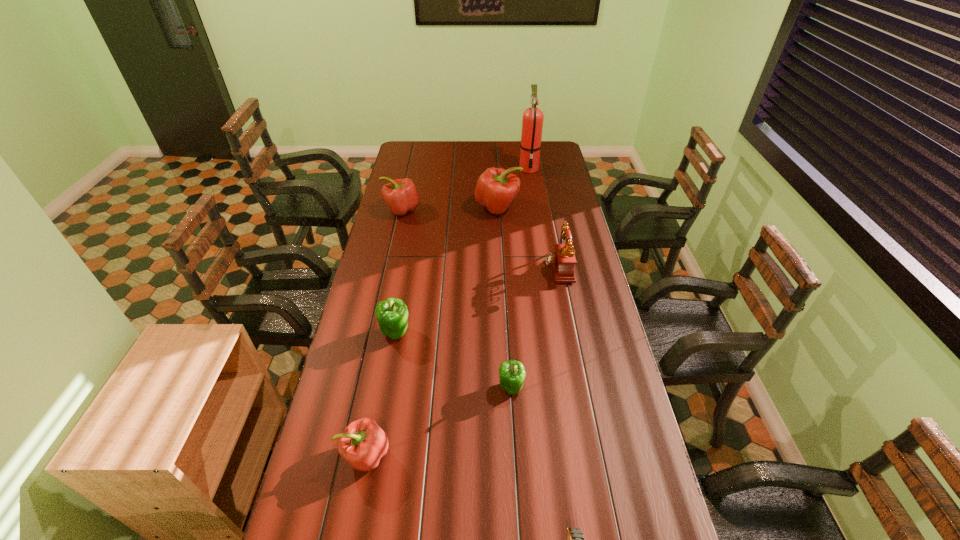
You are a GUI agent. You are given a task and a screenshot of the screen. Output one action in this format:
    pyautogui.click(x=<x>, y=<y>)
    Task: Click on the fire extinguisher
    The height and width of the screenshot is (540, 960).
    Given the screenshot: What is the action you would take?
    pyautogui.click(x=532, y=121)

I want to click on the farthest object, so click(x=532, y=121).

I want to click on the biggest pink bell pepper, so click(x=496, y=189).

Image resolution: width=960 pixels, height=540 pixels. I want to click on the fourth farthest object, so click(x=562, y=260).

Find the location of a particular element. the third farthest bell pepper is located at coordinates (392, 315).

Image resolution: width=960 pixels, height=540 pixels. Identify the location of the left green bell pepper. 392,315.

This screenshot has height=540, width=960. What are the coordinates of `the second biggest pink bell pepper` in the screenshot? It's located at (400, 195).

This screenshot has height=540, width=960. I want to click on the second nearest bell pepper, so click(x=512, y=374).

The height and width of the screenshot is (540, 960). Identify the location of the smaller green bell pepper. (512, 374).

Locate an element on the screen. The image size is (960, 540). the smallest pink bell pepper is located at coordinates (363, 443).